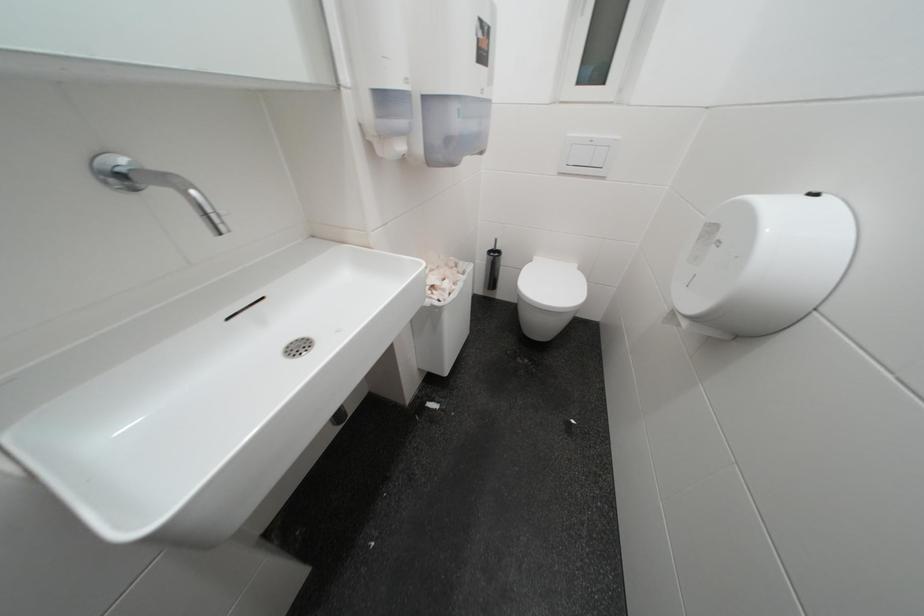
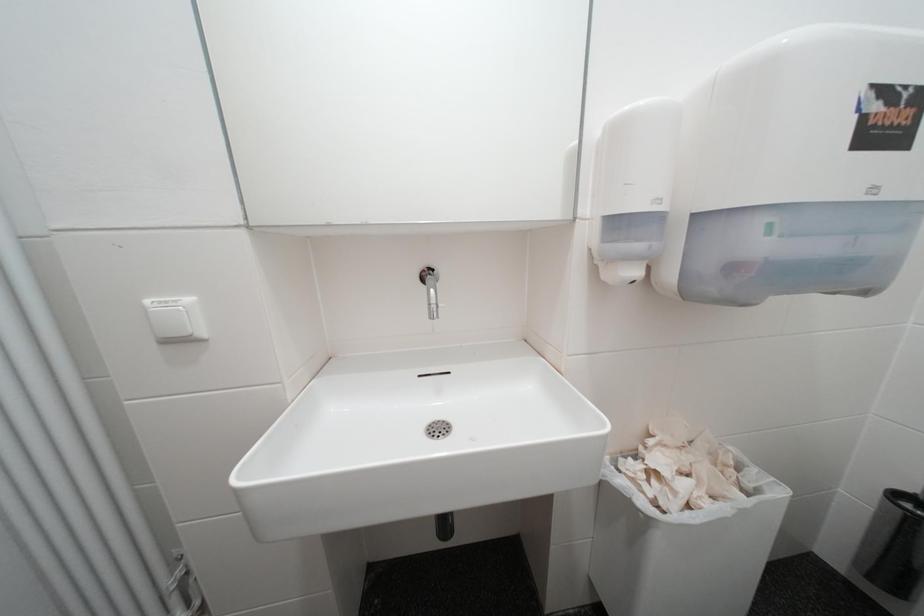
Question: The camera is either moving clockwise (left) or counter-clockwise (right) around the object. The first image is from the beginning of the video and the second image is from the end. Is the camera moving left or right when shooting the video?

Choices:
 (A) Left
 (B) Right

Answer: (B)